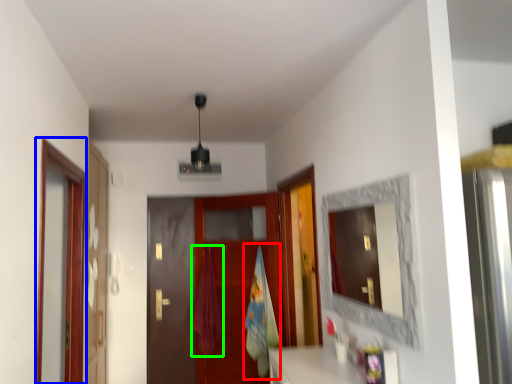
Question: Considering the real-world distances, which object is farthest from beach towel (highlighted by a red box)? screen door (highlighted by a blue box) or curtain (highlighted by a green box)?

Choices:
 (A) screen door
 (B) curtain

Answer: (A)